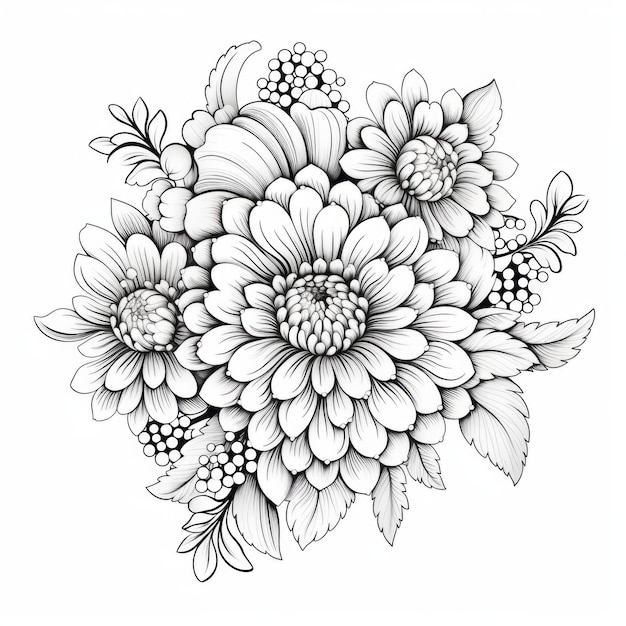
Find the location of a particular element. side flowers is located at coordinates (148, 309), (436, 161).